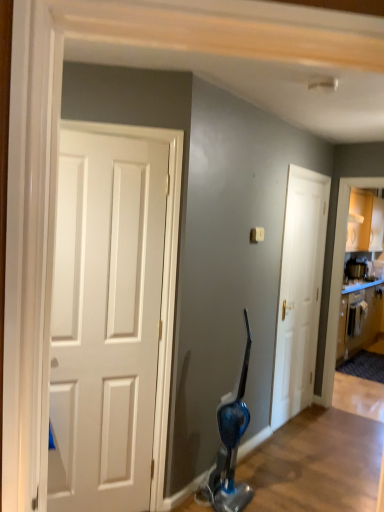
Question: Is metallic silver toaster at upper right facing away from wooden cabinet at right?

Choices:
 (A) yes
 (B) no

Answer: (B)

Question: From a real-world perspective, is metallic silver toaster at upper right physically above wooden cabinet at right?

Choices:
 (A) yes
 (B) no

Answer: (A)

Question: Does metallic silver toaster at upper right lie behind wooden cabinet at right?

Choices:
 (A) yes
 (B) no

Answer: (A)

Question: Is metallic silver toaster at upper right positioned beyond the bounds of wooden cabinet at right?

Choices:
 (A) no
 (B) yes

Answer: (B)

Question: Is metallic silver toaster at upper right at the left side of wooden cabinet at right?

Choices:
 (A) no
 (B) yes

Answer: (B)

Question: Is metallic silver toaster at upper right touching wooden cabinet at right?

Choices:
 (A) no
 (B) yes

Answer: (A)

Question: Is the depth of metallic silver toaster at upper right greater than that of white matte door at center?

Choices:
 (A) yes
 (B) no

Answer: (A)

Question: Is metallic silver toaster at upper right beside white matte door at center?

Choices:
 (A) yes
 (B) no

Answer: (B)

Question: Is metallic silver toaster at upper right facing away from white matte door at center?

Choices:
 (A) no
 (B) yes

Answer: (A)

Question: Is metallic silver toaster at upper right bigger than white matte door at center?

Choices:
 (A) yes
 (B) no

Answer: (B)

Question: From a real-world perspective, is metallic silver toaster at upper right on white matte door at center?

Choices:
 (A) yes
 (B) no

Answer: (A)

Question: Is metallic silver toaster at upper right located outside white matte door at center?

Choices:
 (A) yes
 (B) no

Answer: (A)

Question: Is wooden cabinet at right outside of white matte door at center?

Choices:
 (A) yes
 (B) no

Answer: (A)